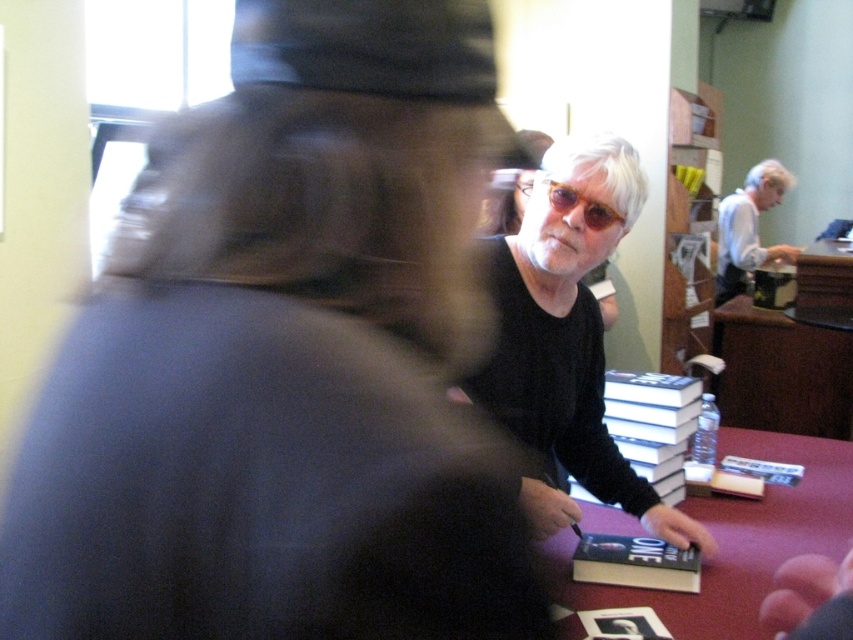
Question: Which object is the closest to the white paperback books at center?

Choices:
 (A) maroon fabric table at lower right
 (B) hardcover book at center
 (C) matte black shirt at center

Answer: (A)

Question: In this image, where is white paperback books at center located relative to hardcover book at center?

Choices:
 (A) below
 (B) above

Answer: (B)

Question: Which object is closer to the camera taking this photo?

Choices:
 (A) maroon fabric table at lower right
 (B) white paperback books at center
 (C) white paper at right
 (D) hardcover book at center

Answer: (A)

Question: Considering the relative positions of hardcover book at center and clear plastic goggles at center in the image provided, where is hardcover book at center located with respect to clear plastic goggles at center?

Choices:
 (A) left
 (B) right

Answer: (B)

Question: Which point is farther from the camera taking this photo?

Choices:
 (A) (727, 225)
 (B) (541, 180)

Answer: (A)

Question: Is white paperback books at center positioned behind hardcover book at center?

Choices:
 (A) yes
 (B) no

Answer: (A)